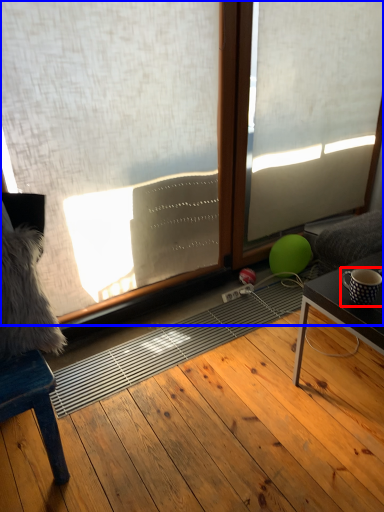
Question: Among these objects, which one is nearest to the camera, coffee cup (highlighted by a red box) or window (highlighted by a blue box)?

Choices:
 (A) coffee cup
 (B) window

Answer: (B)